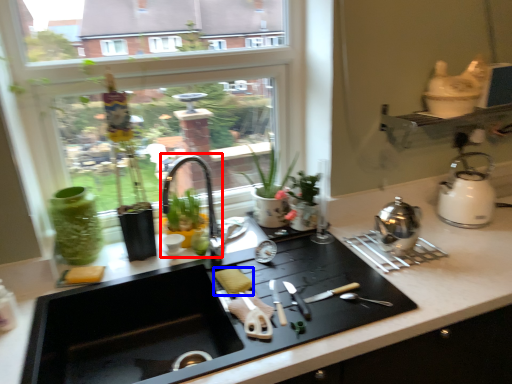
Question: Which point is closer to the camera, faucet (highlighted by a red box) or food (highlighted by a blue box)?

Choices:
 (A) faucet
 (B) food

Answer: (B)